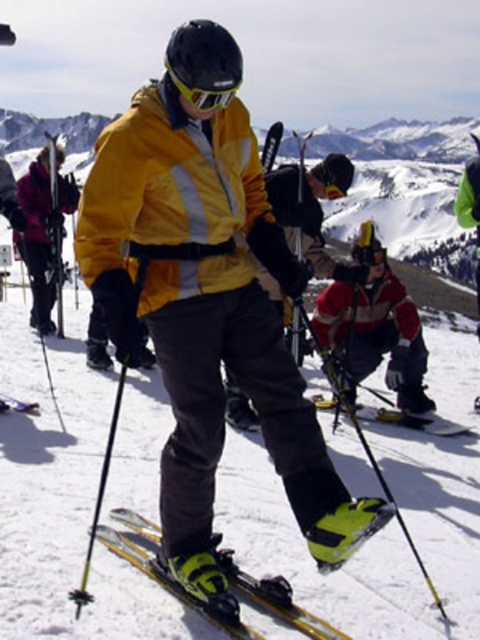
Question: Based on their relative distances, which object is farther from the shiny metallic ski at lower left?

Choices:
 (A) yellow reflective plastic goggles at center
 (B) yellow matte jacket at center
 (C) matte black ski pole at left

Answer: (A)

Question: Is matte black ski pole at left closer to the viewer compared to yellow matte skis at center?

Choices:
 (A) yes
 (B) no

Answer: (B)

Question: Can you confirm if matte black ski pole at left is positioned below yellow matte ski at lower center?

Choices:
 (A) yes
 (B) no

Answer: (B)

Question: Is yellow reflective plastic goggles at center behind green matte jacket at upper right?

Choices:
 (A) no
 (B) yes

Answer: (A)

Question: Based on their relative distances, which object is farther from the matte yellow jacket at center?

Choices:
 (A) red matte jacket at center
 (B) matte black ski pole at left
 (C) yellow reflective plastic goggles at center

Answer: (B)

Question: Which object is the closest to the matte yellow jacket at center?

Choices:
 (A) yellow matte jacket at center
 (B) green matte jacket at upper right

Answer: (A)